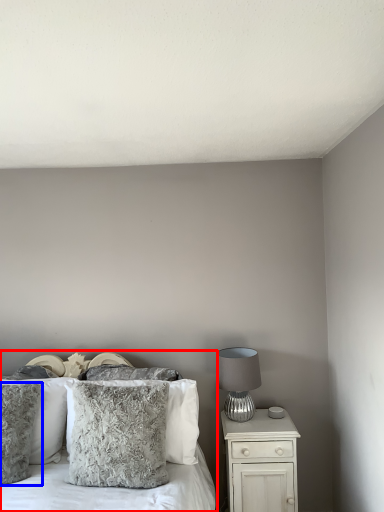
Question: Which object appears farthest to the camera in this image, bed (highlighted by a red box) or pillow (highlighted by a blue box)?

Choices:
 (A) bed
 (B) pillow

Answer: (B)